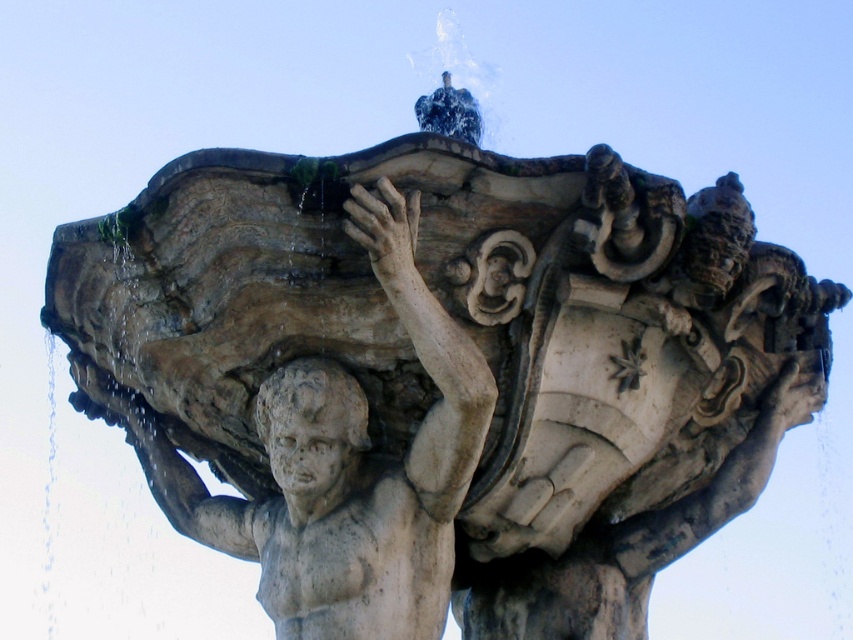
You are standing in front of a classical fountain sculpture. There is a point at coordinates (341, 465). What object is located at that point?

The point at coordinates (341, 465) corresponds to the white stone cherub at center.

Based on the scene description, which object is wider, the white stone cherub at center or the stone head at center?

The white stone cherub at center is wider than the stone head at center according to the description.